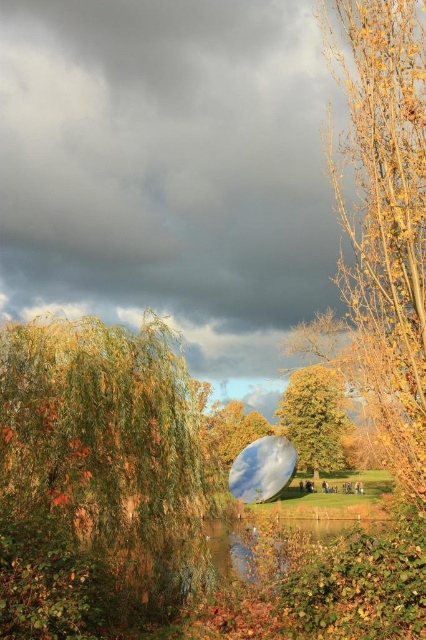
Can you confirm if golden leafy tree at left is smaller than golden textured tree at center?

Incorrect, golden leafy tree at left is not smaller in size than golden textured tree at center.

Is the position of golden leafy tree at left less distant than that of golden textured tree at center?

Yes.

Does point (180, 362) come closer to viewer compared to point (291, 390)?

Yes, it is.

This screenshot has width=426, height=640. What are the coordinates of `golden leafy tree at left` in the screenshot? It's located at (100, 477).

Between yellow leafy tree at right and transparent glass bubble at center, which one appears on the left side from the viewer's perspective?

From the viewer's perspective, transparent glass bubble at center appears more on the left side.

Is yellow leafy tree at right further to camera compared to transparent glass bubble at center?

No, yellow leafy tree at right is closer to the viewer.

Between point (365, 13) and point (268, 460), which one is positioned behind?

Positioned behind is point (268, 460).

Locate an element on the screen. This screenshot has width=426, height=640. yellow leafy tree at right is located at coordinates coord(383,220).

Which is above, golden textured tree at center or transparent glass water at center?

Positioned higher is transparent glass water at center.

Is point (321, 468) in front of point (236, 563)?

That is False.

Between point (291, 381) and point (370, 518), which one is positioned in front?

Point (370, 518) is in front.

Where is `golden textured tree at center`? The width and height of the screenshot is (426, 640). golden textured tree at center is located at coordinates (x=314, y=417).